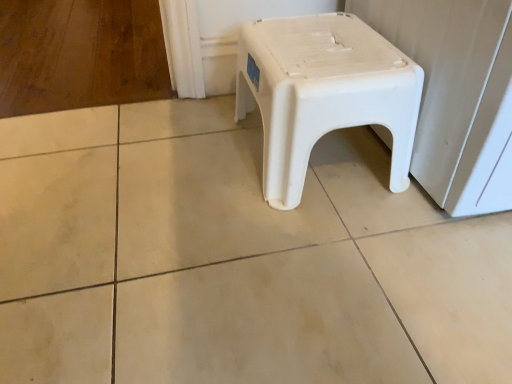
I want to click on free spot to the left of white plastic stool at center, so click(x=180, y=163).